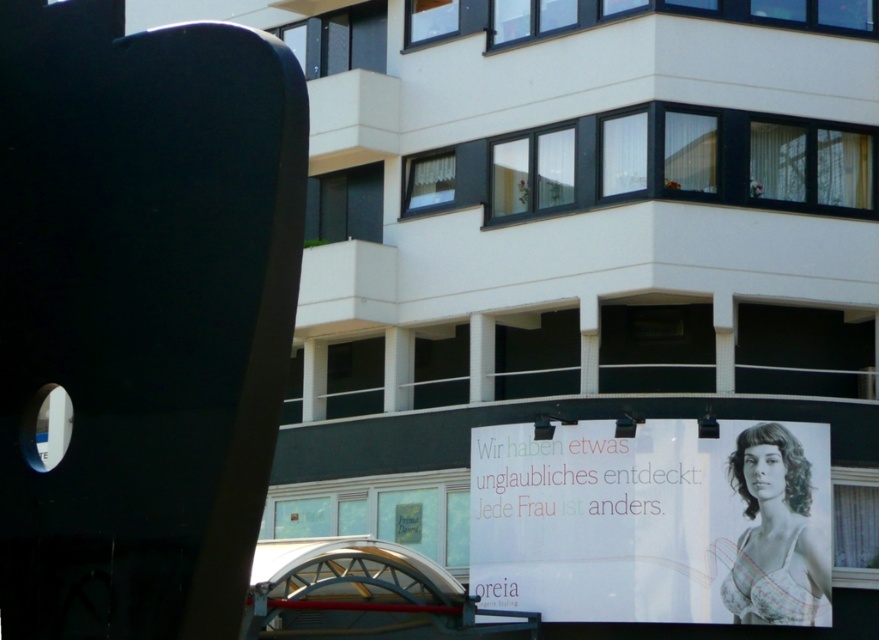
Question: Can you confirm if white paper poster at lower right is wider than matte black bra at center?

Choices:
 (A) no
 (B) yes

Answer: (B)

Question: Can you confirm if white paper poster at lower right is wider than matte black bra at center?

Choices:
 (A) yes
 (B) no

Answer: (A)

Question: Among these points, which one is farthest from the camera?

Choices:
 (A) (749, 474)
 (B) (793, 502)

Answer: (B)

Question: Is the position of white paper poster at lower right more distant than that of matte black bra at center?

Choices:
 (A) yes
 (B) no

Answer: (A)

Question: Which point is closer to the camera?

Choices:
 (A) (781, 595)
 (B) (789, 582)

Answer: (A)

Question: Which of the following is the closest to the observer?

Choices:
 (A) (691, 554)
 (B) (753, 550)

Answer: (B)